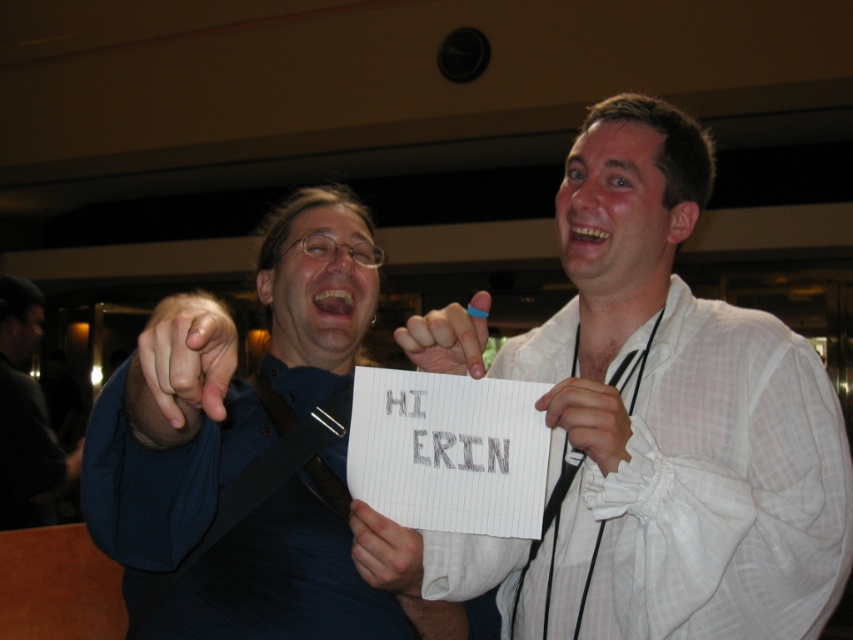
You are organizing a closet and need to place the black leather jacket at left and the white fabric at center into storage. Given their widths, which item requires more horizontal space?

The black leather jacket at left requires more horizontal space because its width surpasses that of the white fabric at center.

You are a photographer standing 3 meters away from the white fabric at center. You want to take a photo of the black leather jacket at left without moving the jacket or the fabric. Can you adjust your position so that the jacket is closer to the camera than the fabric?

The distance between the black leather jacket at left and the white fabric at center is 2.49 meters. Since you are 3 meters away from the fabric, moving closer to the jacket while maintaining the same distance between them would allow the jacket to be closer to the camera than the fabric. Yes, you can adjust your position by moving towards the jacket so that the jacket is now closer to the camera than the fabric.